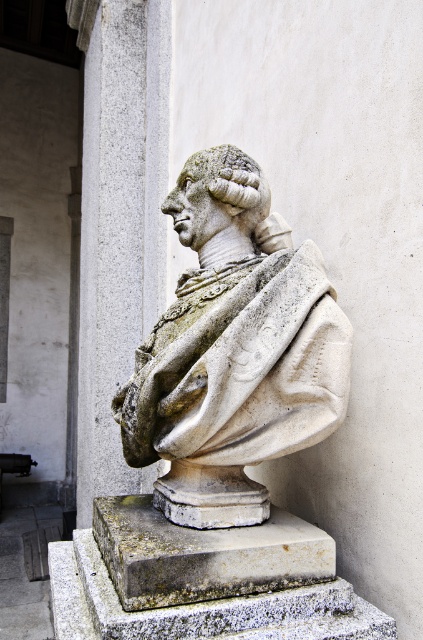
You are an art student standing in front of the white stone bust at center and the gray stone column at left. Which object is positioned to the right of the other?

The white stone bust at center is positioned to the right of the gray stone column at left.

You are an art conservator assessing the placement of the white stone bust at center. Based on its coordinates at point 0.550, 0.551, can you determine if it is positioned centrally within the image?

The white stone bust at center is located at coordinates (233, 352), which is very close to the center point of the image. Therefore, it can be considered centrally positioned.